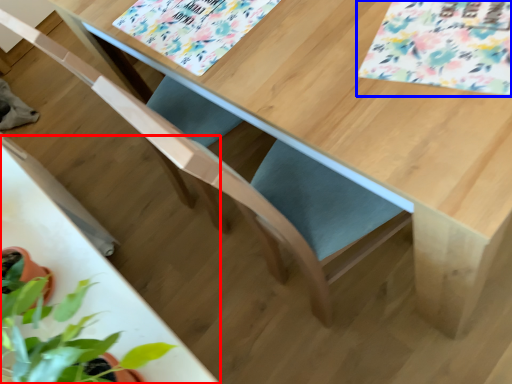
Question: Which object is closer to the camera taking this photo, round table (highlighted by a red box) or flower (highlighted by a blue box)?

Choices:
 (A) round table
 (B) flower

Answer: (A)